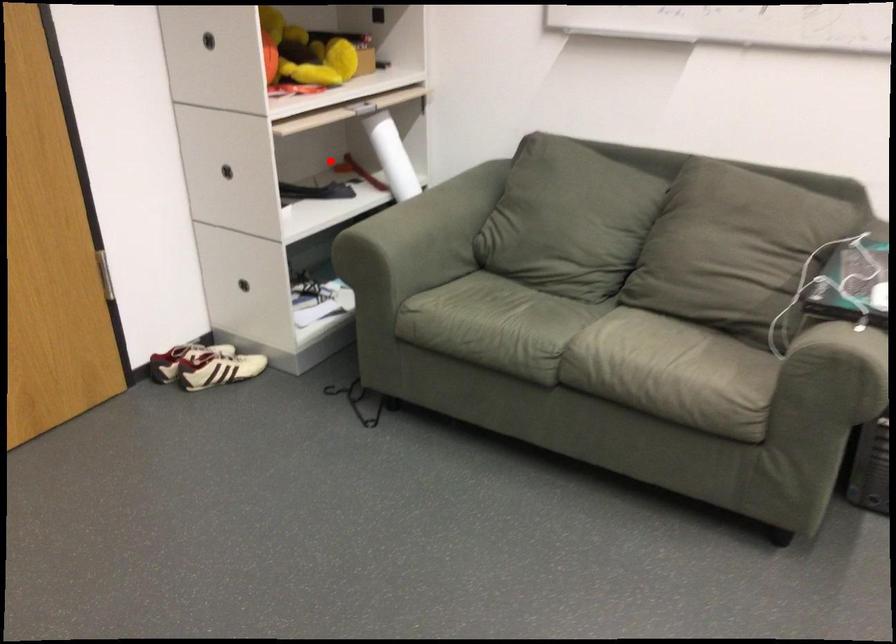
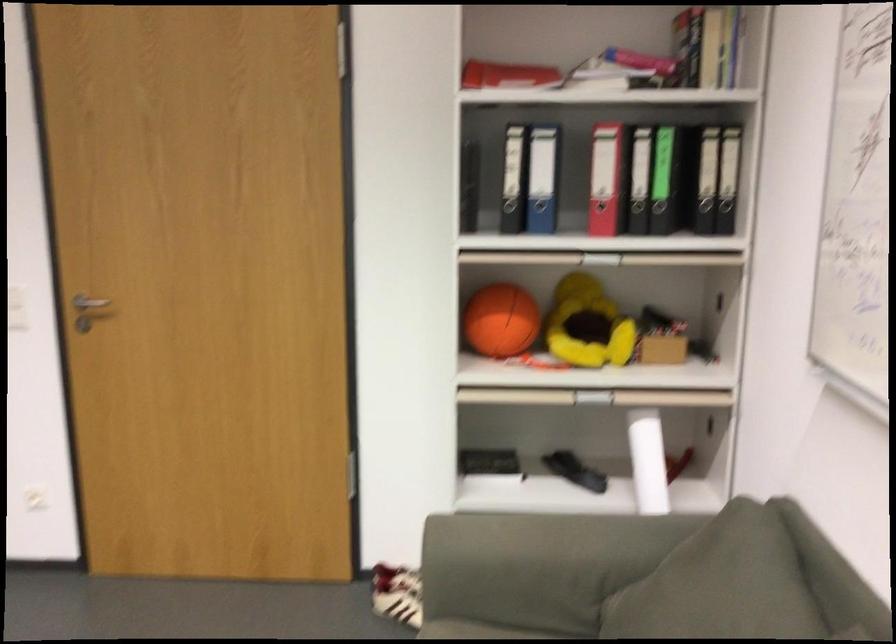
Question: I am providing you with two images of the same scene from different viewpoints. A red point is marked on the first image. At the location where the point appears in image 1, is it still visible in image 2?

Choices:
 (A) Yes
 (B) No

Answer: (B)